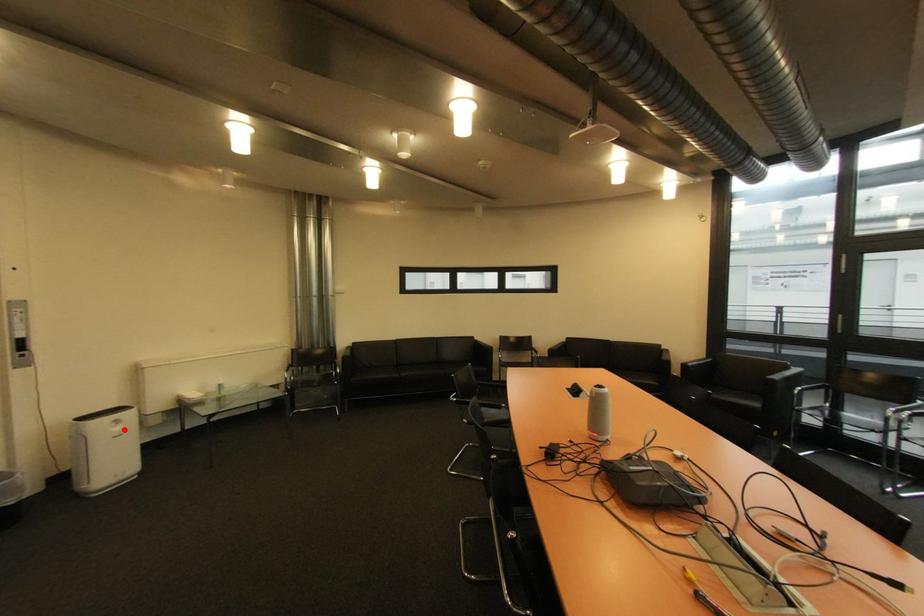
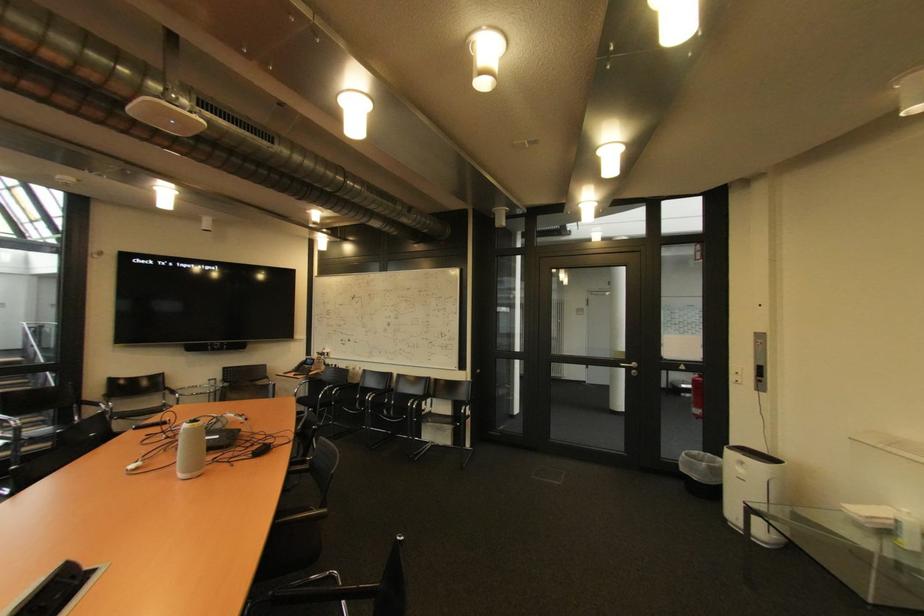
Where in the second image is the point corresponding to the highlighted location from the first image?

(748, 471)